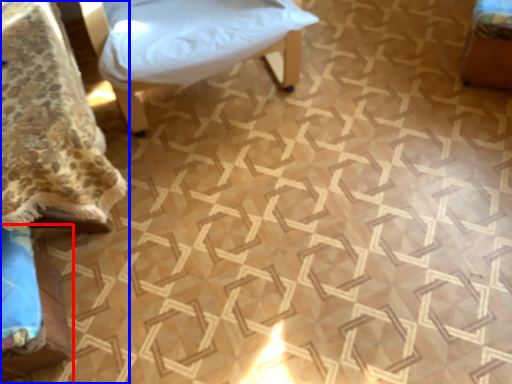
Question: Which object appears closest to the camera in this image, furniture (highlighted by a red box) or furniture (highlighted by a blue box)?

Choices:
 (A) furniture
 (B) furniture

Answer: (B)